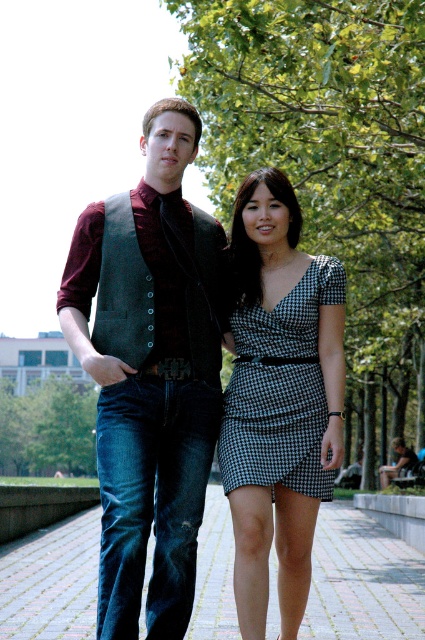
Based on the photo, you are standing at the point with coordinates point (306, 483) and want to walk towards the point with coordinates point (175, 490). Which direction should you move relative to your current position?

You should move forward because point (175, 490) is in front of point (306, 483).

You are standing at the point closest to the camera in the image. Which point, point (201,627) or point (317,365), is farther away from you?

Point (201,627) is behind point (317,365), so it is farther away from you.

Looking at this image, you are a photographer standing 10 meters away from the camera position. You want to take a closeup shot of the velvet vest at center. Can you reach the vest within your current position without moving closer?

The velvet vest at center is 6.74 meters from the camera. Since you are already 10 meters away from the camera position, you are 3.26 meters behind the vest. Therefore, you cannot reach the velvet vest at center from your current position without moving closer.